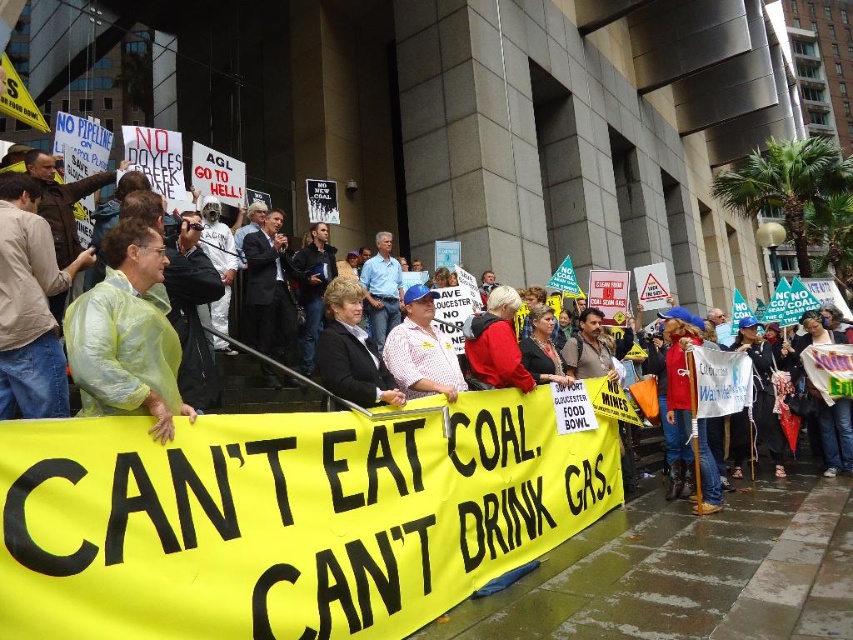
Who is positioned more to the left, light green plastic bag at left or plaid shirt at center?

light green plastic bag at left

Does light green plastic bag at left have a lesser width compared to plaid shirt at center?

Incorrect, light green plastic bag at left's width is not less than plaid shirt at center's.

Image resolution: width=853 pixels, height=640 pixels. In order to click on light green plastic bag at left in this screenshot , I will do `click(126, 333)`.

Is plaid shirt at center taller than red matte jacket at center?

No.

Is plaid shirt at center to the left of red matte jacket at center from the viewer's perspective?

Yes, plaid shirt at center is to the left of red matte jacket at center.

What do you see at coordinates (421, 349) in the screenshot? I see `plaid shirt at center` at bounding box center [421, 349].

At what (x,y) coordinates should I click in order to perform the action: click on plaid shirt at center. Please return your answer as a coordinate pair (x, y). Looking at the image, I should click on (421, 349).

Is the position of black fabric jacket at center less distant than that of light blue shirt at center?

Yes, black fabric jacket at center is closer to the viewer.

Does black fabric jacket at center appear on the right side of light blue shirt at center?

Yes, black fabric jacket at center is to the right of light blue shirt at center.

What do you see at coordinates (351, 352) in the screenshot?
I see `black fabric jacket at center` at bounding box center [351, 352].

Find the location of `black fabric jacket at center`. black fabric jacket at center is located at coordinates (351, 352).